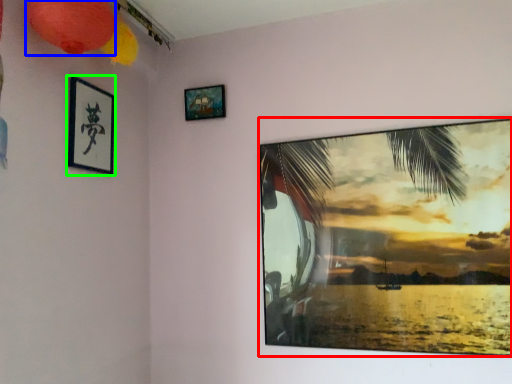
Question: Estimate the real-world distances between objects in this image. Which object is farther from picture frame (highlighted by a red box), lantern (highlighted by a blue box) or picture frame (highlighted by a green box)?

Choices:
 (A) lantern
 (B) picture frame

Answer: (A)